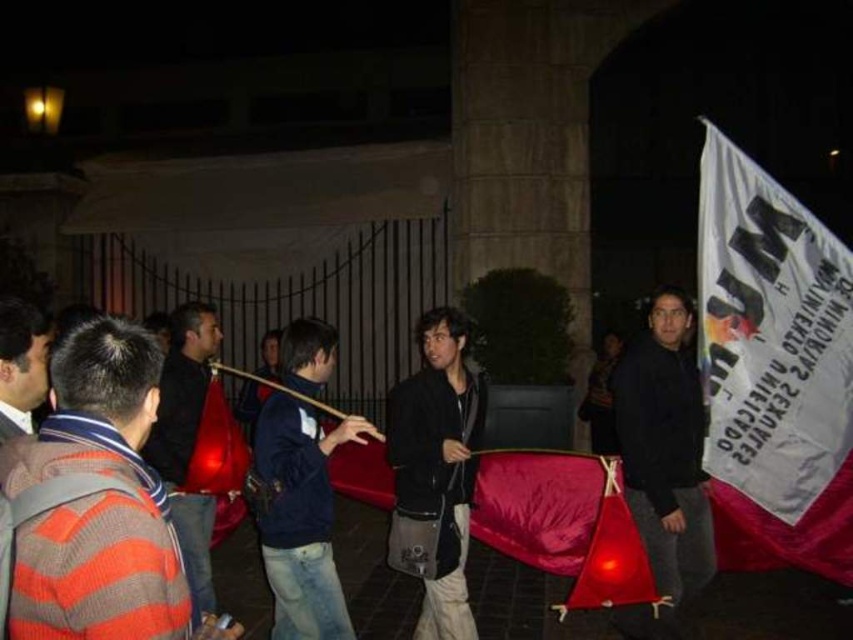
Question: Considering the relative positions of white fabric banner at right and striped sweater at left in the image provided, where is white fabric banner at right located with respect to striped sweater at left?

Choices:
 (A) below
 (B) above

Answer: (B)

Question: Among these points, which one is nearest to the camera?

Choices:
 (A) (326, 518)
 (B) (703, 528)
 (C) (117, 513)

Answer: (C)

Question: Estimate the real-world distances between objects in this image. Which object is closer to the striped wool sweater at left?

Choices:
 (A) black matte jacket at right
 (B) matte black jacket at center

Answer: (B)

Question: Which object is farther from the camera taking this photo?

Choices:
 (A) white fabric banner at right
 (B) navy blue jacket at center

Answer: (A)

Question: Can you confirm if black matte jacket at right is smaller than navy blue jacket at center?

Choices:
 (A) yes
 (B) no

Answer: (B)

Question: Can you confirm if black matte jacket at right is wider than matte black jacket at center?

Choices:
 (A) no
 (B) yes

Answer: (B)